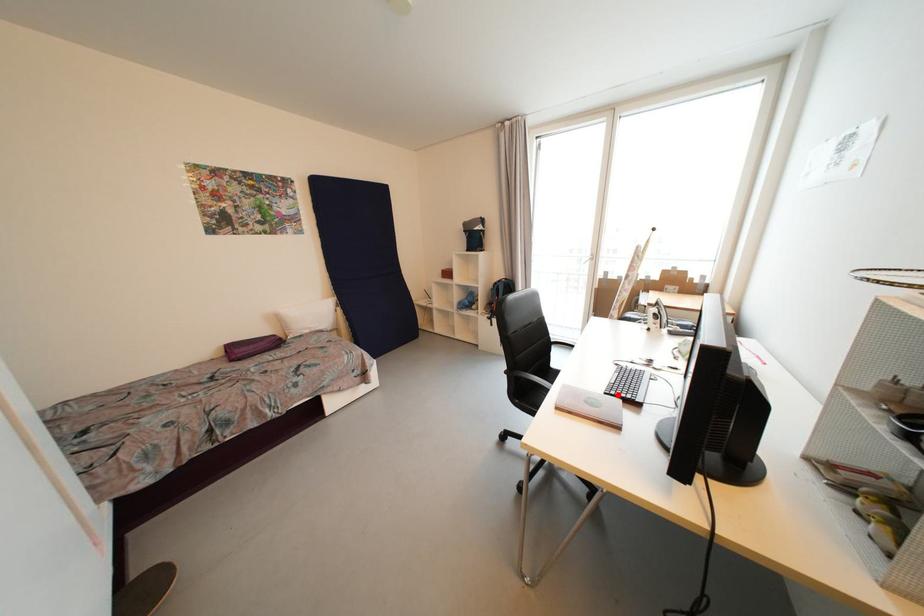
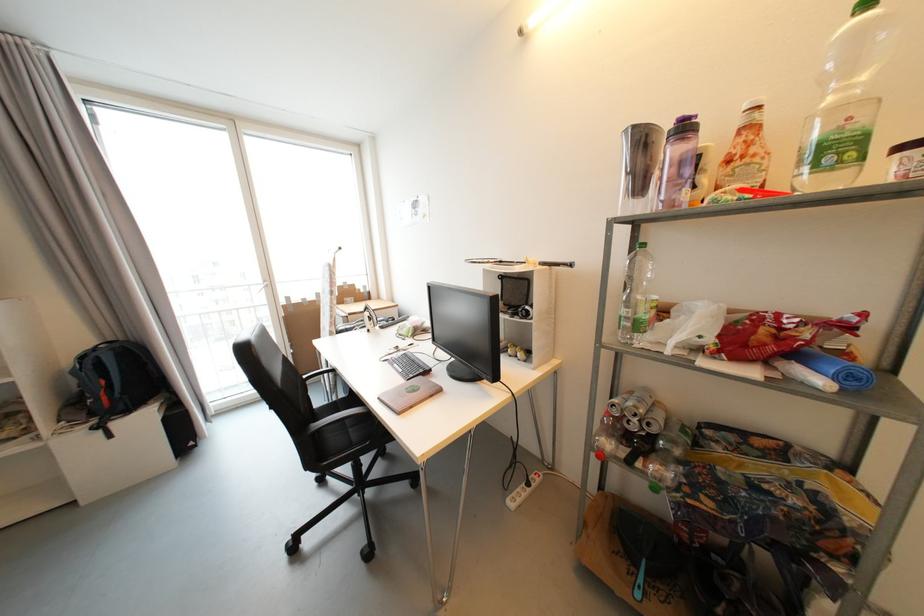
Question: I am providing you with two images of the same scene from different viewpoints. Image1 has a red point marked. In image2, the corresponding 3D location appears at what relative position? Reply with the corresponding letter.

Choices:
 (A) Closer
 (B) Farther

Answer: (B)